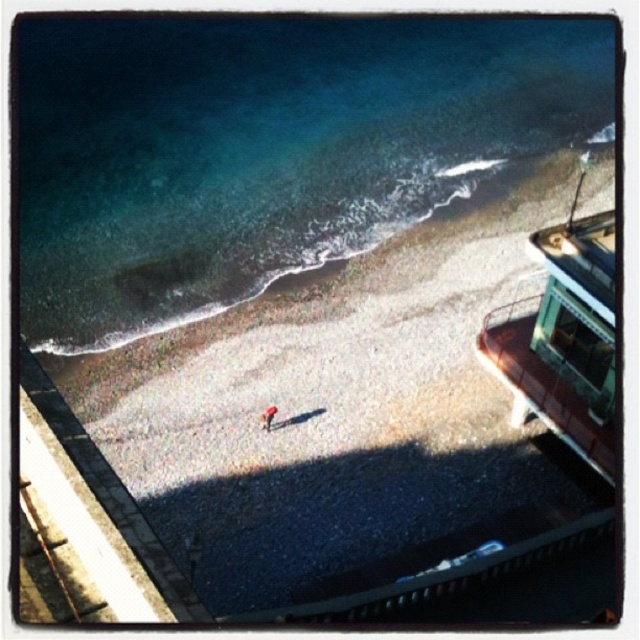
You are standing on the balcony overlooking the beach. You see the gray gravelly sand at center and the clear blue water at upper left. Which one is lower in height compared to the other?

The gray gravelly sand at center is not as tall as the clear blue water at upper left, meaning the gray gravelly sand at center is lower in height compared to the clear blue water at upper left.

You are standing on the balcony overlooking the beach. You see the metallic green boat at right. Can you estimate its position in terms of coordinates?

The metallic green boat at right is located at coordinates approximately at point [564,337].